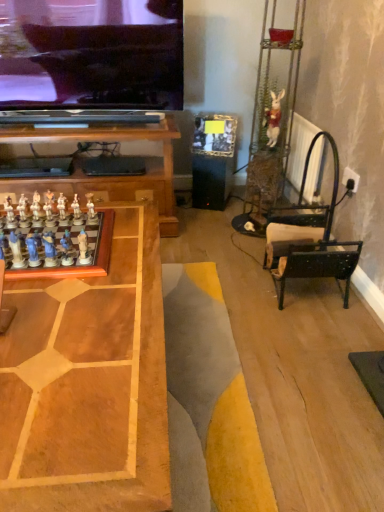
Where is `free space to the right of matte blue chess piece at left, marked as the 3th toy in a front-to-back arrangement`? The height and width of the screenshot is (512, 384). free space to the right of matte blue chess piece at left, marked as the 3th toy in a front-to-back arrangement is located at coordinates (90, 270).